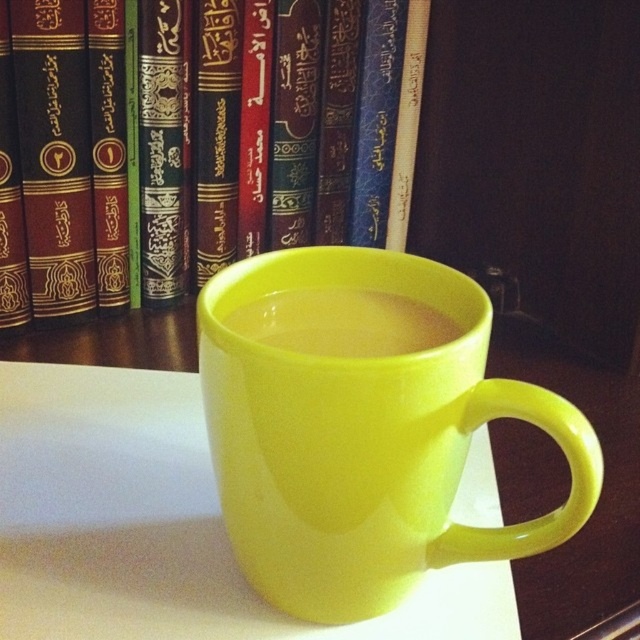
Who is lower down, matte black book at center or glossy ceramic mug at center?

glossy ceramic mug at center is lower down.

From the picture: Is matte black book at center wider than glossy ceramic mug at center?

Correct, the width of matte black book at center exceeds that of glossy ceramic mug at center.

Which is in front, point (33, 182) or point (570, 438)?

Positioned in front is point (570, 438).

The height and width of the screenshot is (640, 640). Identify the location of matte black book at center. (195, 141).

Can you confirm if matte black book at center is positioned below translucent plastic liquid at center?

No, matte black book at center is not below translucent plastic liquid at center.

Can you confirm if matte black book at center is positioned above translucent plastic liquid at center?

Yes, matte black book at center is above translucent plastic liquid at center.

This screenshot has height=640, width=640. What are the coordinates of `matte black book at center` in the screenshot? It's located at [195, 141].

Does glossy ceramic mug at center have a lesser width compared to translucent plastic liquid at center?

In fact, glossy ceramic mug at center might be wider than translucent plastic liquid at center.

Does glossy ceramic mug at center appear over translucent plastic liquid at center?

Actually, glossy ceramic mug at center is below translucent plastic liquid at center.

Who is more distant from viewer, (449, 362) or (244, 305)?

Positioned behind is point (244, 305).

Find the location of `glossy ceramic mug at center`. glossy ceramic mug at center is located at coordinates (362, 426).